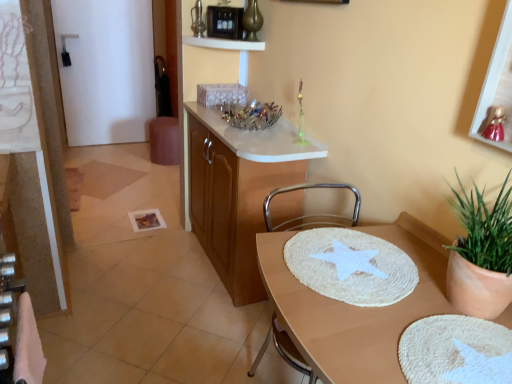
Identify the location of black plastic microwave at upper center. The width and height of the screenshot is (512, 384). (224, 22).

This screenshot has height=384, width=512. What do you see at coordinates (106, 69) in the screenshot?
I see `white glossy door at upper left` at bounding box center [106, 69].

What is the approximate width of white glossy shelf at upper center?

white glossy shelf at upper center is 24.91 centimeters wide.

Where is `white glossy shelf at upper center`? This screenshot has width=512, height=384. white glossy shelf at upper center is located at coordinates (224, 43).

The height and width of the screenshot is (384, 512). Find the location of `white woven mat at center`. white woven mat at center is located at coordinates pyautogui.click(x=351, y=266).

The image size is (512, 384). What do you see at coordinates (351, 266) in the screenshot? I see `white woven mat at center` at bounding box center [351, 266].

Where is `black plastic microwave at upper center`? black plastic microwave at upper center is located at coordinates (224, 22).

Consider the image. Is black plastic microwave at upper center oriented towards white glossy shelf at upper center?

No, black plastic microwave at upper center is not facing towards white glossy shelf at upper center.

Which object is wider, black plastic microwave at upper center or white glossy shelf at upper center?

Wider between the two is white glossy shelf at upper center.

Can you tell me how much black plastic microwave at upper center and white glossy shelf at upper center differ in facing direction?

48.9 degrees separate the facing orientations of black plastic microwave at upper center and white glossy shelf at upper center.

Is black plastic microwave at upper center positioned before white glossy shelf at upper center?

No, black plastic microwave at upper center is behind white glossy shelf at upper center.

Considering the relative sizes of white glossy door at upper left and beige woven placemat at center in the image provided, is white glossy door at upper left smaller than beige woven placemat at center?

Yes, white glossy door at upper left is smaller than beige woven placemat at center.

How many degrees apart are the facing directions of white glossy door at upper left and beige woven placemat at center?

The angular difference between white glossy door at upper left and beige woven placemat at center is 89.8 degrees.

Measure the distance from white glossy door at upper left to beige woven placemat at center.

3.35 meters.

Identify the location of glass door on the left of the beige woven placemat at center. This screenshot has height=384, width=512. (106, 69).

From the image's perspective, which is below, white glossy door at upper left or wooden cabinet at center?

wooden cabinet at center is shown below in the image.

Locate an element on the screen. Image resolution: width=512 pixels, height=384 pixels. glass door above the wooden cabinet at center (from the image's perspective) is located at coordinates (106, 69).

From a real-world perspective, is white glossy door at upper left above or below wooden cabinet at center?

white glossy door at upper left is above wooden cabinet at center.

In the scene shown: Considering the relative sizes of white glossy door at upper left and wooden cabinet at center in the image provided, is white glossy door at upper left bigger than wooden cabinet at center?

Incorrect, white glossy door at upper left is not larger than wooden cabinet at center.

From a real-world perspective, which is physically above, metallic gold picture frame at upper right or white glossy shelf at upper center?

metallic gold picture frame at upper right, from a real-world perspective.

Would you say metallic gold picture frame at upper right is a long distance from white glossy shelf at upper center?

Yes, metallic gold picture frame at upper right and white glossy shelf at upper center are located far from each other.

Between point (484, 94) and point (231, 48), which one is positioned behind?

The point (231, 48) is behind.

Between metallic gold picture frame at upper right and white glossy shelf at upper center, which one is positioned behind?

white glossy shelf at upper center.

Is wooden cabinet at center oriented towards metallic silver chair at center?

No.

Is wooden cabinet at center inside the boundaries of metallic silver chair at center, or outside?

wooden cabinet at center is outside metallic silver chair at center.

Does point (212, 204) come farther from viewer compared to point (292, 361)?

Yes, it is behind point (292, 361).

Would you consider wooden cabinet at center to be distant from metallic silver chair at center?

No, wooden cabinet at center is in close proximity to metallic silver chair at center.

Is metallic gold picture frame at upper right completely or partially outside of wooden cabinet at center?

That's correct, metallic gold picture frame at upper right is outside of wooden cabinet at center.

Could you tell me if metallic gold picture frame at upper right is turned towards wooden cabinet at center?

No.

Which object is positioned more to the right, metallic gold picture frame at upper right or wooden cabinet at center?

Positioned to the right is metallic gold picture frame at upper right.

Is metallic gold picture frame at upper right not near wooden cabinet at center?

Yes, metallic gold picture frame at upper right is far from wooden cabinet at center.

Is metallic gold picture frame at upper right at the left side of white woven mat at center?

No.

Does metallic gold picture frame at upper right touch white woven mat at center?

No, metallic gold picture frame at upper right is not making contact with white woven mat at center.

From the image's perspective, is metallic gold picture frame at upper right located above or below white woven mat at center?

From the image's perspective, metallic gold picture frame at upper right appears above white woven mat at center.

In the image, is metallic gold picture frame at upper right positioned in front of or behind white woven mat at center?

In the image, metallic gold picture frame at upper right appears in front of white woven mat at center.

Locate an element on the screen. The width and height of the screenshot is (512, 384). shelf that appears on the left of black plastic microwave at upper center is located at coordinates (224, 43).

The width and height of the screenshot is (512, 384). In order to click on glass door located above the beige woven placemat at center (from a real-world perspective) in this screenshot , I will do `click(106, 69)`.

Considering their positions, is white woven mat at center positioned further to wooden cabinet at center than gold metallic vase at upper center?

Among the two, gold metallic vase at upper center is located further to wooden cabinet at center.

Looking at the image, which one is located further to gold metallic vase at upper center, black plastic microwave at upper center or white glossy shelf at upper center?

white glossy shelf at upper center is positioned further to the anchor gold metallic vase at upper center.

Based on their spatial positions, is gold metallic vase at upper center or black plastic microwave at upper center further from metallic gold picture frame at upper right?

black plastic microwave at upper center is positioned further to the anchor metallic gold picture frame at upper right.

Estimate the real-world distances between objects in this image. Which object is closer to white woven mat at center, beige woven placemat at center or metallic silver chair at center?

beige woven placemat at center is positioned closer to the anchor white woven mat at center.

Based on their spatial positions, is white woven mat at center or white glossy door at upper left closer to gold metallic vase at upper center?

Based on the image, white woven mat at center appears to be nearer to gold metallic vase at upper center.

Considering their positions, is white glossy door at upper left positioned further to metallic silver chair at center than gold metallic vase at upper center?

white glossy door at upper left lies further to metallic silver chair at center than the other object.

Considering their positions, is beige woven placemat at center positioned closer to white glossy shelf at upper center than white glossy door at upper left?

Based on the image, beige woven placemat at center appears to be nearer to white glossy shelf at upper center.

Considering their positions, is black plastic microwave at upper center positioned closer to wooden cabinet at center than beige woven placemat at center?

Based on the image, beige woven placemat at center appears to be nearer to wooden cabinet at center.

Where is `picture frame positioned between beige woven placemat at center and wooden cabinet at center from near to far`? picture frame positioned between beige woven placemat at center and wooden cabinet at center from near to far is located at coordinates (497, 92).

Where is `mat located between beige woven placemat at center and black plastic microwave at upper center in the depth direction`? mat located between beige woven placemat at center and black plastic microwave at upper center in the depth direction is located at coordinates (x=351, y=266).

The height and width of the screenshot is (384, 512). I want to click on chair between metallic gold picture frame at upper right and white glossy shelf at upper center along the z-axis, so click(310, 188).

The width and height of the screenshot is (512, 384). In order to click on appliance located between metallic gold picture frame at upper right and white glossy door at upper left in the depth direction in this screenshot , I will do `click(224, 22)`.